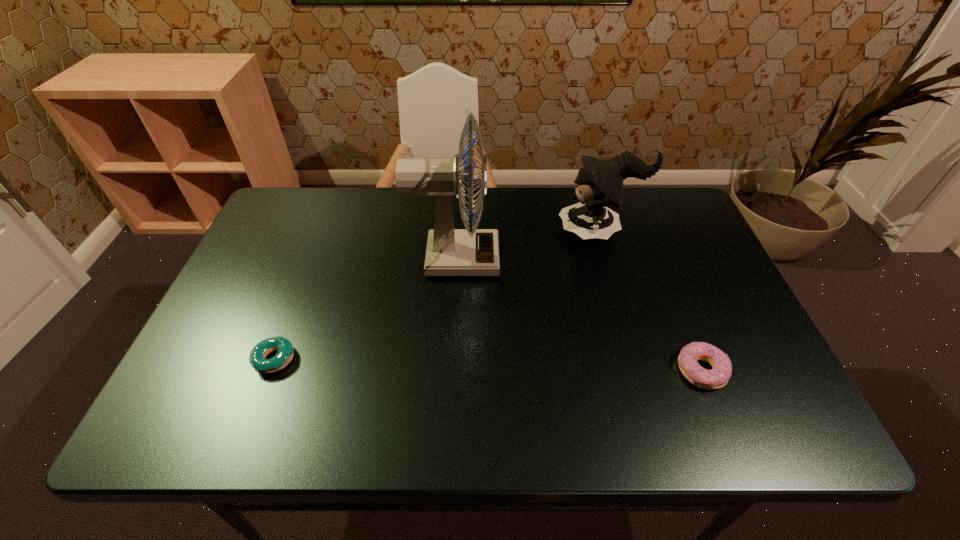
I want to click on vacant region that satisfies the following two spatial constraints: 1. on the front-facing side of the tallest object; 2. on the front side of the shortest object, so (x=449, y=360).

What are the coordinates of `free region that satisfies the following two spatial constraints: 1. on the front-facing side of the tallest object; 2. on the left side of the right doughnut` in the screenshot? It's located at (448, 370).